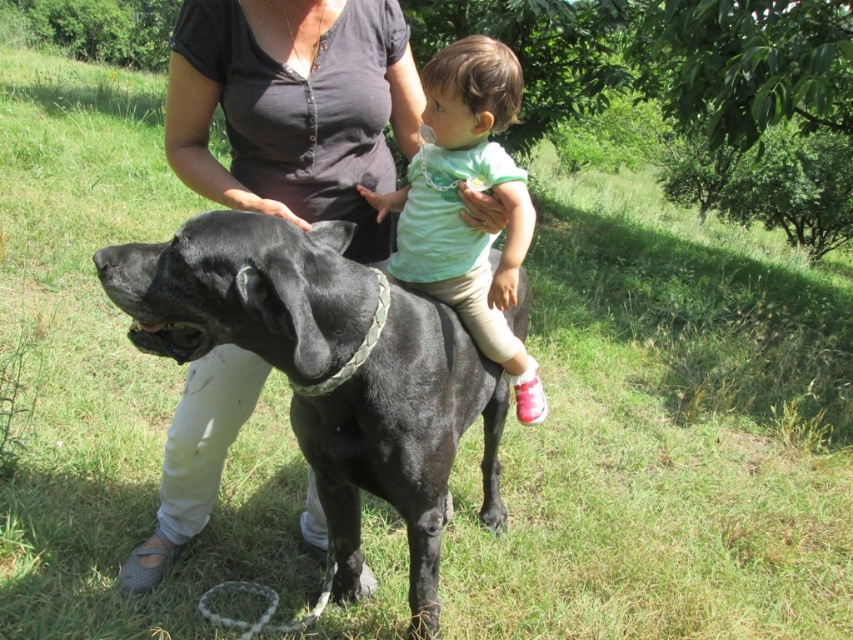
You are a photographer setting up a tripod to take a portrait of the shiny black dog at center and the light green fabric shirt at center. The tripod has a height adjustment feature. Which object should you adjust the tripod height to match first to ensure both subjects are in focus?

The shiny black dog at center is taller than the light green fabric shirt at center, so you should adjust the tripod height to match the height of the shiny black dog at center first to ensure both subjects are in focus.

You are a photographer standing in front of the shiny black dog at center and the light green fabric shirt at center. You want to take a photo of both subjects but need to focus on the one that is closer to you. Which object should you focus on?

The shiny black dog at center is closer to the viewer than the light green fabric shirt at center, so you should focus on the shiny black dog at center.